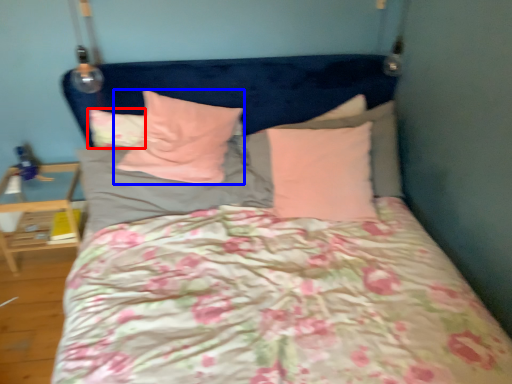
Question: Which object is further to the camera taking this photo, pillow (highlighted by a red box) or pillow (highlighted by a blue box)?

Choices:
 (A) pillow
 (B) pillow

Answer: (A)